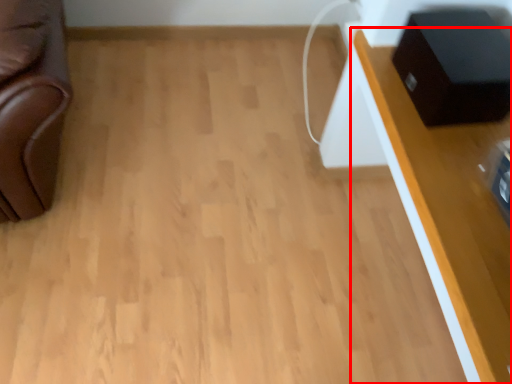
Question: From the image's perspective, considering the relative positions of table (annotated by the red box) and speaker in the image provided, where is table (annotated by the red box) located with respect to the staircase?

Choices:
 (A) above
 (B) below

Answer: (B)